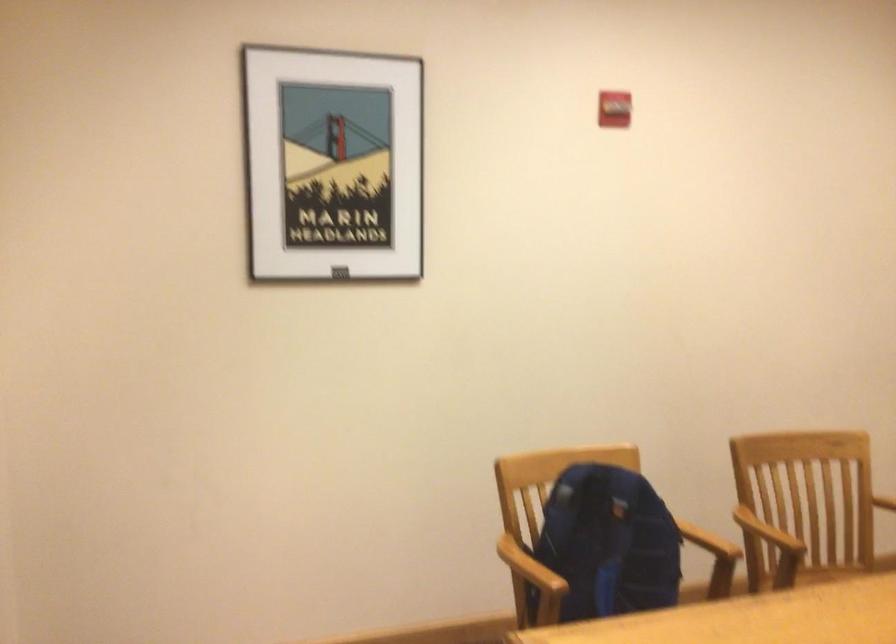
Identify the location of chair sitting surface. The image size is (896, 644). (837, 572).